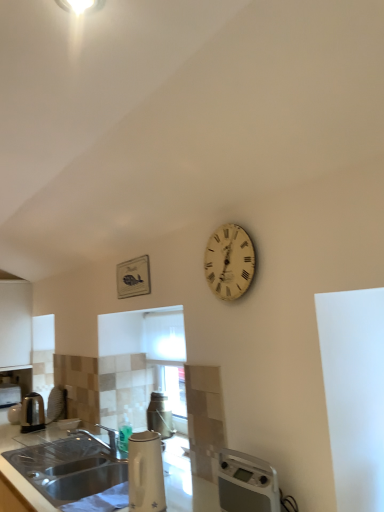
This screenshot has width=384, height=512. What do you see at coordinates (146, 472) in the screenshot?
I see `white glossy electric kettle at lower center` at bounding box center [146, 472].

This screenshot has height=512, width=384. What do you see at coordinates (104, 442) in the screenshot? I see `silver metallic tap at lower left` at bounding box center [104, 442].

Where is `white plastic water heater at lower right`? This screenshot has width=384, height=512. white plastic water heater at lower right is located at coordinates (246, 483).

The width and height of the screenshot is (384, 512). Find the location of `polished stainless steel kettle at left`. polished stainless steel kettle at left is located at coordinates pos(32,413).

The image size is (384, 512). Identify the location of white glossy countertop at lower left. (186, 481).

Is white glossy electric kettle at lower center situated inside white plastic water heater at lower right or outside?

white glossy electric kettle at lower center is not inside white plastic water heater at lower right, it's outside.

Can you confirm if white glossy electric kettle at lower center is positioned to the right of white plastic water heater at lower right?

In fact, white glossy electric kettle at lower center is to the left of white plastic water heater at lower right.

How distant is white glossy electric kettle at lower center from white plastic water heater at lower right?

white glossy electric kettle at lower center is 11.44 inches from white plastic water heater at lower right.

Can you confirm if polished stainless steel kettle at left is thinner than white matte cabinet at left?

Yes, polished stainless steel kettle at left is thinner than white matte cabinet at left.

From the image's perspective, is polished stainless steel kettle at left beneath white matte cabinet at left?

Yes, from the image's perspective, polished stainless steel kettle at left is beneath white matte cabinet at left.

Could you tell me if polished stainless steel kettle at left is turned towards white matte cabinet at left?

No.

Is white wooden clock at upper right not inside white plastic water heater at lower right?

That's correct, white wooden clock at upper right is outside of white plastic water heater at lower right.

Considering the relative sizes of white wooden clock at upper right and white plastic water heater at lower right in the image provided, is white wooden clock at upper right bigger than white plastic water heater at lower right?

No, white wooden clock at upper right is not bigger than white plastic water heater at lower right.

Between white wooden clock at upper right and white plastic water heater at lower right, which one has more height?

white wooden clock at upper right is taller.

Measure the distance from white matte cabinet at left to white wooden clock at upper right.

white matte cabinet at left and white wooden clock at upper right are 2.70 meters apart from each other.

Considering the relative sizes of white matte cabinet at left and white wooden clock at upper right in the image provided, is white matte cabinet at left wider than white wooden clock at upper right?

Yes, white matte cabinet at left is wider than white wooden clock at upper right.

Would you say white wooden clock at upper right is part of white matte cabinet at left's contents?

That's incorrect, white wooden clock at upper right is not inside white matte cabinet at left.

Is white matte cabinet at left spatially inside white glossy electric kettle at lower center, or outside of it?

white matte cabinet at left is not enclosed by white glossy electric kettle at lower center.

Measure the distance from white matte cabinet at left to white glossy electric kettle at lower center.

white matte cabinet at left and white glossy electric kettle at lower center are 8.48 feet apart.

From the image's perspective, which is below, white matte cabinet at left or white glossy electric kettle at lower center?

white glossy electric kettle at lower center, from the image's perspective.

Would you say white plastic water heater at lower right is a long distance from silver metallic tap at lower left?

Actually, white plastic water heater at lower right and silver metallic tap at lower left are a little close together.

Is white plastic water heater at lower right behind silver metallic tap at lower left?

No, white plastic water heater at lower right is in front of silver metallic tap at lower left.

From a real-world perspective, is white plastic water heater at lower right positioned above or below silver metallic tap at lower left?

white plastic water heater at lower right is situated higher than silver metallic tap at lower left in the real world.

Between silver metallic tap at lower left and white glossy electric kettle at lower center, which one has larger width?

With larger width is silver metallic tap at lower left.

Does silver metallic tap at lower left have a larger size compared to white glossy electric kettle at lower center?

Correct, silver metallic tap at lower left is larger in size than white glossy electric kettle at lower center.

Is silver metallic tap at lower left located outside white glossy electric kettle at lower center?

That's correct, silver metallic tap at lower left is outside of white glossy electric kettle at lower center.

Find the location of a particular element. water heater that appears above the white glossy electric kettle at lower center (from the image's perspective) is located at coordinates (246, 483).

Where is `cabinetry behind the polished stainless steel kettle at left`? The image size is (384, 512). cabinetry behind the polished stainless steel kettle at left is located at coordinates (15, 323).

From the image, which object appears to be farther from white glossy countertop at lower left, silver metallic tap at lower left or white plastic water heater at lower right?

Based on the image, white plastic water heater at lower right appears to be further to white glossy countertop at lower left.

From the picture: When comparing their distances from white plastic water heater at lower right, does white matte cabinet at left or white glossy countertop at lower left seem closer?

white glossy countertop at lower left is positioned closer to the anchor white plastic water heater at lower right.

Based on their spatial positions, is white glossy countertop at lower left or polished stainless steel kettle at left further from white plastic water heater at lower right?

The object further to white plastic water heater at lower right is polished stainless steel kettle at left.

Which object lies nearer to the anchor point polished stainless steel kettle at left, silver metallic tap at lower left or white matte cabinet at left?

silver metallic tap at lower left is closer to polished stainless steel kettle at left.

From the image, which object appears to be nearer to polished stainless steel kettle at left, white wooden clock at upper right or silver metallic tap at lower left?

silver metallic tap at lower left.

Looking at the image, which one is located further to white glossy electric kettle at lower center, white wooden clock at upper right or polished stainless steel kettle at left?

Among the two, polished stainless steel kettle at left is located further to white glossy electric kettle at lower center.

Considering their positions, is white glossy electric kettle at lower center positioned closer to white glossy countertop at lower left than polished stainless steel kettle at left?

The object closer to white glossy countertop at lower left is polished stainless steel kettle at left.

Based on their spatial positions, is white matte cabinet at left or polished stainless steel kettle at left closer to white plastic water heater at lower right?

Based on the image, polished stainless steel kettle at left appears to be nearer to white plastic water heater at lower right.

You are a GUI agent. You are given a task and a screenshot of the screen. Output one action in this format:
    pyautogui.click(x=<x>, y=<y>)
    Task: Click on the tap located between white plastic water heater at lower right and white matte cabinet at left in the depth direction
    The width and height of the screenshot is (384, 512).
    Given the screenshot: What is the action you would take?
    pyautogui.click(x=104, y=442)

In order to click on wall clock between white glossy electric kettle at lower center and white matte cabinet at left from front to back in this screenshot , I will do `click(229, 262)`.

Locate an element on the screen. Image resolution: width=384 pixels, height=512 pixels. tap between polished stainless steel kettle at left and white wooden clock at upper right from left to right is located at coordinates (104, 442).

The height and width of the screenshot is (512, 384). Find the location of `tap positioned between white plastic water heater at lower right and polished stainless steel kettle at left from near to far`. tap positioned between white plastic water heater at lower right and polished stainless steel kettle at left from near to far is located at coordinates (104, 442).